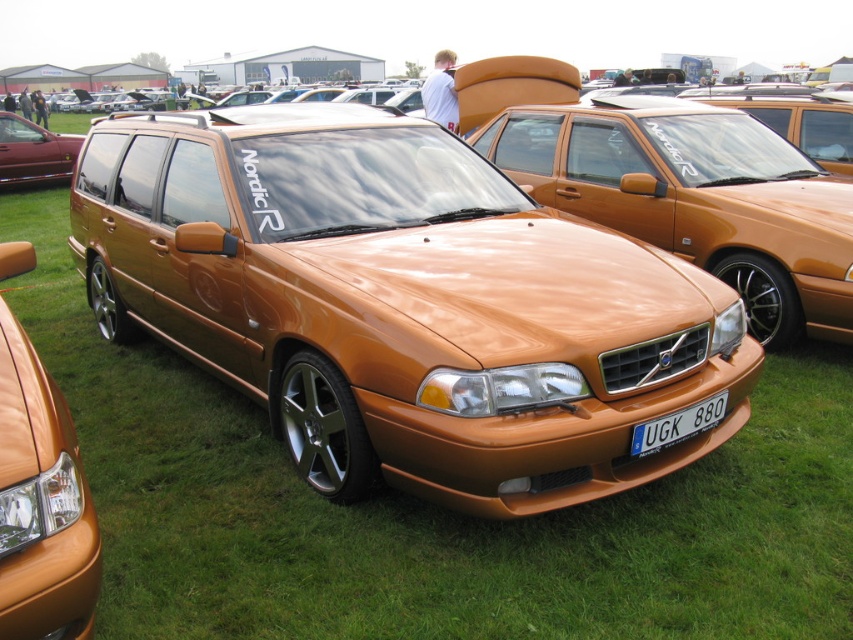
Can you confirm if metallic gold sedan at center is shorter than metallic red sedan at left?

In fact, metallic gold sedan at center may be taller than metallic red sedan at left.

Who is taller, metallic gold sedan at center or metallic red sedan at left?

metallic gold sedan at center is taller.

Does point (839, 282) lie in front of point (12, 177)?

Yes, it is.

The image size is (853, 640). I want to click on metallic gold sedan at center, so click(676, 186).

Measure the distance from metallic gold sedan at center to white plastic license plate at center.

metallic gold sedan at center and white plastic license plate at center are 2.79 meters apart.

Can you confirm if metallic gold sedan at center is positioned below white plastic license plate at center?

No.

Is point (776, 147) positioned behind point (674, 419)?

Yes, point (776, 147) is behind point (674, 419).

The height and width of the screenshot is (640, 853). What are the coordinates of `metallic gold sedan at center` in the screenshot? It's located at (676, 186).

Based on the photo, can you confirm if metallic red sedan at left is positioned to the right of white plastic license plate at center?

No, metallic red sedan at left is not to the right of white plastic license plate at center.

Which is behind, point (62, 148) or point (677, 433)?

Point (62, 148)

The width and height of the screenshot is (853, 640). In order to click on metallic red sedan at left in this screenshot , I will do `click(33, 150)`.